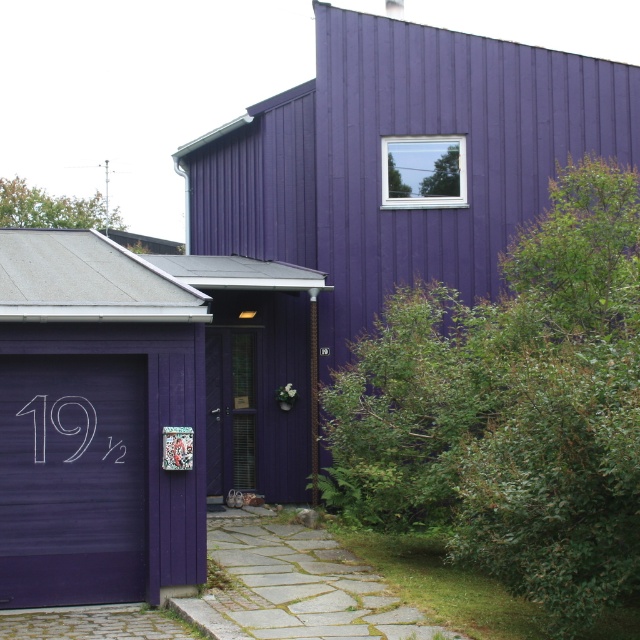
Question: Can you confirm if matte purple door at center is bigger than white chalk-like at lower left?

Choices:
 (A) no
 (B) yes

Answer: (B)

Question: Which point is farther to the camera?

Choices:
 (A) purple woodshed at left
 (B) matte purple door at center
 (C) matte purple garage door at left
 (D) white chalk-like at lower left

Answer: (A)

Question: Is matte purple garage door at left bigger than matte purple door at center?

Choices:
 (A) no
 (B) yes

Answer: (B)

Question: Which of these objects is positioned closest to the matte purple door at center?

Choices:
 (A) matte purple garage door at left
 (B) purple woodshed at left

Answer: (B)

Question: Does matte purple door at center appear on the right side of white chalk-like at lower left?

Choices:
 (A) yes
 (B) no

Answer: (A)

Question: Among these objects, which one is farthest from the camera?

Choices:
 (A) matte purple garage door at left
 (B) purple woodshed at left
 (C) white chalk-like at lower left

Answer: (B)